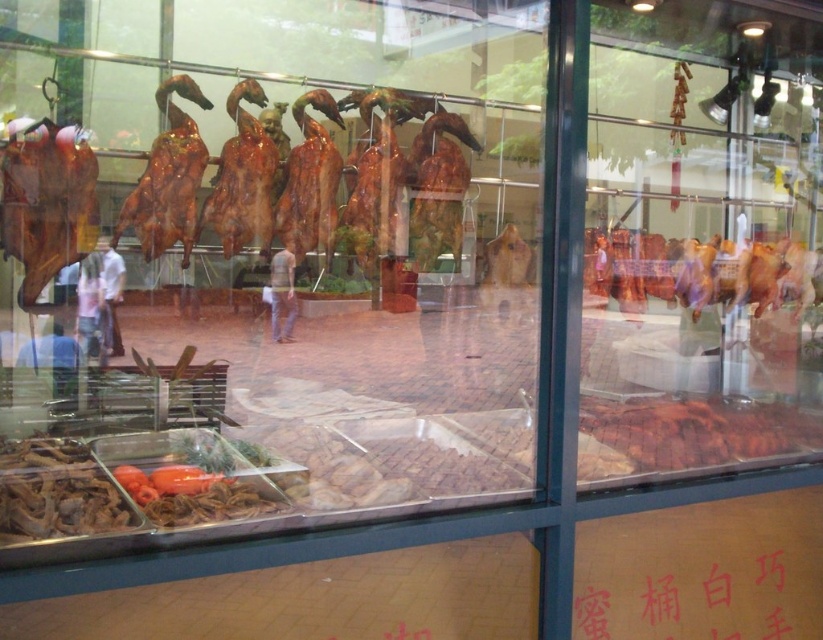
Question: Considering the real-world distances, which object is farthest from the pink glossy chicken at center?

Choices:
 (A) light brown leather jacket at center
 (B) red paper sign at center
 (C) brown matte dried mushrooms at lower left
 (D) shiny brown duck at left

Answer: (A)

Question: Which object is positioned farthest from the shiny brown duck at left?

Choices:
 (A) pink glossy chicken at center
 (B) brown matte dried mushrooms at lower left

Answer: (A)

Question: Is brown matte roasted duck at center further to the viewer compared to shiny brown duck at left?

Choices:
 (A) yes
 (B) no

Answer: (A)

Question: Does shiny brown duck at left have a smaller size compared to light brown leather jacket at center?

Choices:
 (A) no
 (B) yes

Answer: (B)

Question: Considering the relative positions of shiny brown duck at left and brown matte dried mushrooms at lower left in the image provided, where is shiny brown duck at left located with respect to brown matte dried mushrooms at lower left?

Choices:
 (A) above
 (B) below

Answer: (A)

Question: Among these objects, which one is farthest from the camera?

Choices:
 (A) light brown leather jacket at center
 (B) pink glossy chicken at center
 (C) brown matte roasted duck at center

Answer: (A)